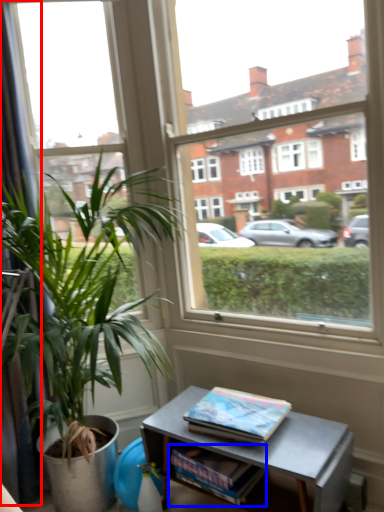
Question: Which object appears closest to the camera in this image, curtain (highlighted by a red box) or magazine (highlighted by a blue box)?

Choices:
 (A) curtain
 (B) magazine

Answer: (B)